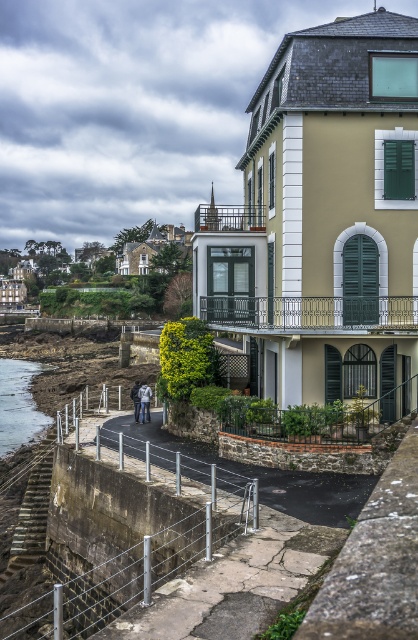
You are standing on the raised stone platform in front of the building and want to get to the clear water at lower left. Which direction should you walk to reach it?

You should walk towards the lower left direction to reach the clear water at lower left since it is located at point (18,403).

Based on the photo, you are standing on the raised stone platform in front of the two story building. You want to go to the clear water at lower left. What direction should you walk to reach it?

You should walk towards the lower left direction to reach the clear water at lower left since it is located at point (18, 403) which is in the lower left area of the scene.

You are standing at the entrance of the two story building and want to locate the green matte shutter at upper right. According to the coordinates provided, where exactly would you find it?

The green matte shutter at upper right is located at point (399, 170), so it is positioned at the upper right corner of the building.